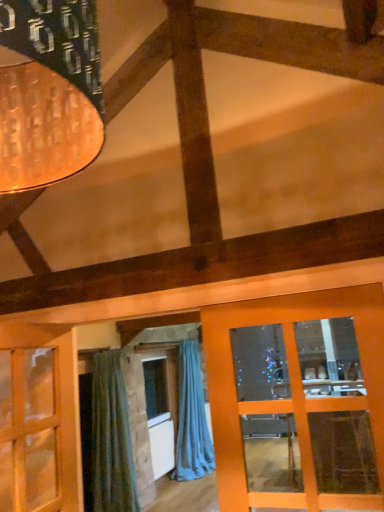
This screenshot has width=384, height=512. Describe the element at coordinates (111, 439) in the screenshot. I see `green fabric curtain at lower left, marked as the first curtain in a left-to-right arrangement` at that location.

The image size is (384, 512). Identify the location of green fabric curtain at lower left, placed as the 2th curtain when sorted from back to front. (111, 439).

Locate an element on the screen. Image resolution: width=384 pixels, height=512 pixels. blue fabric curtain at center, positioned as the first curtain in back-to-front order is located at coordinates (192, 419).

The image size is (384, 512). What do you see at coordinates (192, 419) in the screenshot? I see `blue fabric curtain at center, positioned as the 2th curtain in left-to-right order` at bounding box center [192, 419].

You are a GUI agent. You are given a task and a screenshot of the screen. Output one action in this format:
    pyautogui.click(x=<x>, y=<y>)
    Task: Click on the green fabric curtain at lower left, which is counted as the 1th curtain, starting from the front
    
    Given the screenshot: What is the action you would take?
    pyautogui.click(x=111, y=439)

Considering the relative positions of blue fabric curtain at center, positioned as the first curtain in back-to-front order, and green fabric curtain at lower left, positioned as the 2th curtain in right-to-left order, in the image provided, is blue fabric curtain at center, positioned as the first curtain in back-to-front order, to the right of green fabric curtain at lower left, positioned as the 2th curtain in right-to-left order, from the viewer's perspective?

Indeed, blue fabric curtain at center, positioned as the first curtain in back-to-front order, is positioned on the right side of green fabric curtain at lower left, positioned as the 2th curtain in right-to-left order.

Which object is further away from the camera taking this photo, blue fabric curtain at center, positioned as the 2th curtain in left-to-right order, or green fabric curtain at lower left, marked as the first curtain in a left-to-right arrangement?

blue fabric curtain at center, positioned as the 2th curtain in left-to-right order, is further away from the camera.

Is point (203, 395) closer to camera compared to point (116, 443)?

No, (203, 395) is further to viewer.

From the image's perspective, is blue fabric curtain at center, positioned as the first curtain in back-to-front order, below green fabric curtain at lower left, positioned as the 2th curtain in right-to-left order?

Yes, from the image's perspective, blue fabric curtain at center, positioned as the first curtain in back-to-front order, is below green fabric curtain at lower left, positioned as the 2th curtain in right-to-left order.

From a real-world perspective, who is located higher, blue fabric curtain at center, marked as the 2th curtain in a front-to-back arrangement, or green fabric curtain at lower left, marked as the first curtain in a left-to-right arrangement?

From a 3D spatial view, green fabric curtain at lower left, marked as the first curtain in a left-to-right arrangement, is above.

Which object is thinner, blue fabric curtain at center, placed as the first curtain when sorted from right to left, or green fabric curtain at lower left, positioned as the 2th curtain in right-to-left order?

green fabric curtain at lower left, positioned as the 2th curtain in right-to-left order, is thinner.

Considering the relative sizes of blue fabric curtain at center, positioned as the first curtain in back-to-front order, and green fabric curtain at lower left, which is counted as the 1th curtain, starting from the front, in the image provided, is blue fabric curtain at center, positioned as the first curtain in back-to-front order, taller than green fabric curtain at lower left, which is counted as the 1th curtain, starting from the front,?

Yes.

Is blue fabric curtain at center, positioned as the 2th curtain in left-to-right order, smaller than green fabric curtain at lower left, placed as the 2th curtain when sorted from back to front?

No.

Can we say blue fabric curtain at center, positioned as the first curtain in back-to-front order, lies outside green fabric curtain at lower left, placed as the 2th curtain when sorted from back to front?

Yes, blue fabric curtain at center, positioned as the first curtain in back-to-front order, is outside of green fabric curtain at lower left, placed as the 2th curtain when sorted from back to front.

Can you see blue fabric curtain at center, placed as the first curtain when sorted from right to left, touching green fabric curtain at lower left, placed as the 2th curtain when sorted from back to front?

No, blue fabric curtain at center, placed as the first curtain when sorted from right to left, is not beside green fabric curtain at lower left, placed as the 2th curtain when sorted from back to front.

Is blue fabric curtain at center, positioned as the 2th curtain in left-to-right order, facing away from green fabric curtain at lower left, which is counted as the 1th curtain, starting from the front?

blue fabric curtain at center, positioned as the 2th curtain in left-to-right order, is not turned away from green fabric curtain at lower left, which is counted as the 1th curtain, starting from the front.

Could you measure the distance between blue fabric curtain at center, positioned as the 2th curtain in left-to-right order, and green fabric curtain at lower left, positioned as the 2th curtain in right-to-left order?

blue fabric curtain at center, positioned as the 2th curtain in left-to-right order, is 6.92 feet away from green fabric curtain at lower left, positioned as the 2th curtain in right-to-left order.

Locate an element on the screen. This screenshot has width=384, height=512. curtain behind the green fabric curtain at lower left, placed as the 2th curtain when sorted from back to front is located at coordinates (192, 419).

Is green fabric curtain at lower left, positioned as the 2th curtain in right-to-left order, to the left of blue fabric curtain at center, placed as the first curtain when sorted from right to left, from the viewer's perspective?

Yes, green fabric curtain at lower left, positioned as the 2th curtain in right-to-left order, is to the left of blue fabric curtain at center, placed as the first curtain when sorted from right to left.

From the picture: Considering the positions of objects green fabric curtain at lower left, marked as the first curtain in a left-to-right arrangement, and blue fabric curtain at center, placed as the first curtain when sorted from right to left, in the image provided, who is behind, green fabric curtain at lower left, marked as the first curtain in a left-to-right arrangement, or blue fabric curtain at center, placed as the first curtain when sorted from right to left,?

blue fabric curtain at center, placed as the first curtain when sorted from right to left, is further away from the camera.

Which is less distant, (103, 374) or (198, 455)?

Clearly, point (103, 374) is closer to the camera than point (198, 455).

From the image's perspective, is green fabric curtain at lower left, marked as the first curtain in a left-to-right arrangement, located above blue fabric curtain at center, placed as the first curtain when sorted from right to left?

Yes.

From the picture: From a real-world perspective, is green fabric curtain at lower left, marked as the first curtain in a left-to-right arrangement, positioned under blue fabric curtain at center, positioned as the 2th curtain in left-to-right order, based on gravity?

No, from a real-world perspective, green fabric curtain at lower left, marked as the first curtain in a left-to-right arrangement, is not under blue fabric curtain at center, positioned as the 2th curtain in left-to-right order.

Between green fabric curtain at lower left, positioned as the 2th curtain in right-to-left order, and blue fabric curtain at center, positioned as the 2th curtain in left-to-right order, which one has smaller width?

With smaller width is green fabric curtain at lower left, positioned as the 2th curtain in right-to-left order.

Between green fabric curtain at lower left, positioned as the 2th curtain in right-to-left order, and blue fabric curtain at center, placed as the first curtain when sorted from right to left, which one has less height?

Standing shorter between the two is green fabric curtain at lower left, positioned as the 2th curtain in right-to-left order.

Looking at the image, does green fabric curtain at lower left, placed as the 2th curtain when sorted from back to front, seem bigger or smaller compared to blue fabric curtain at center, marked as the 2th curtain in a front-to-back arrangement?

green fabric curtain at lower left, placed as the 2th curtain when sorted from back to front, is smaller than blue fabric curtain at center, marked as the 2th curtain in a front-to-back arrangement.

Is green fabric curtain at lower left, which is counted as the 1th curtain, starting from the front, outside of blue fabric curtain at center, marked as the 2th curtain in a front-to-back arrangement?

Indeed, green fabric curtain at lower left, which is counted as the 1th curtain, starting from the front, is completely outside blue fabric curtain at center, marked as the 2th curtain in a front-to-back arrangement.

Is green fabric curtain at lower left, placed as the 2th curtain when sorted from back to front, with blue fabric curtain at center, positioned as the 2th curtain in left-to-right order?

green fabric curtain at lower left, placed as the 2th curtain when sorted from back to front, and blue fabric curtain at center, positioned as the 2th curtain in left-to-right order, are not in contact.

Is green fabric curtain at lower left, placed as the 2th curtain when sorted from back to front, turned away from blue fabric curtain at center, positioned as the first curtain in back-to-front order?

No.

How far apart are green fabric curtain at lower left, which is counted as the 1th curtain, starting from the front, and blue fabric curtain at center, marked as the 2th curtain in a front-to-back arrangement?

They are 2.11 meters apart.

Locate an element on the screen. This screenshot has height=512, width=384. curtain on the right side of green fabric curtain at lower left, positioned as the 2th curtain in right-to-left order is located at coordinates (192, 419).

At what (x,y) coordinates should I click in order to perform the action: click on curtain that appears in front of the blue fabric curtain at center, positioned as the 2th curtain in left-to-right order. Please return your answer as a coordinate pair (x, y). Image resolution: width=384 pixels, height=512 pixels. Looking at the image, I should click on (111, 439).

At what (x,y) coordinates should I click in order to perform the action: click on curtain on the right of green fabric curtain at lower left, marked as the first curtain in a left-to-right arrangement. Please return your answer as a coordinate pair (x, y). Looking at the image, I should click on (192, 419).